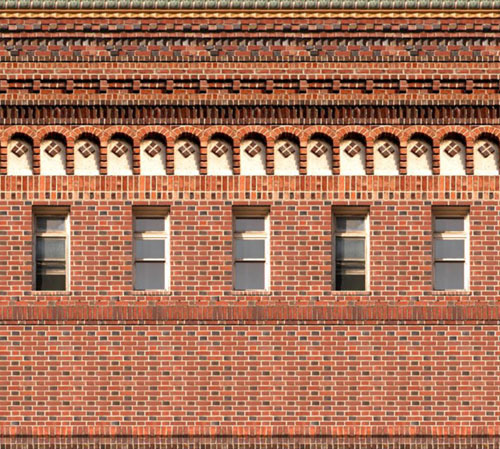
Identify the location of white accents under arches. The height and width of the screenshot is (449, 500). (19, 164), (50, 164), (84, 164).